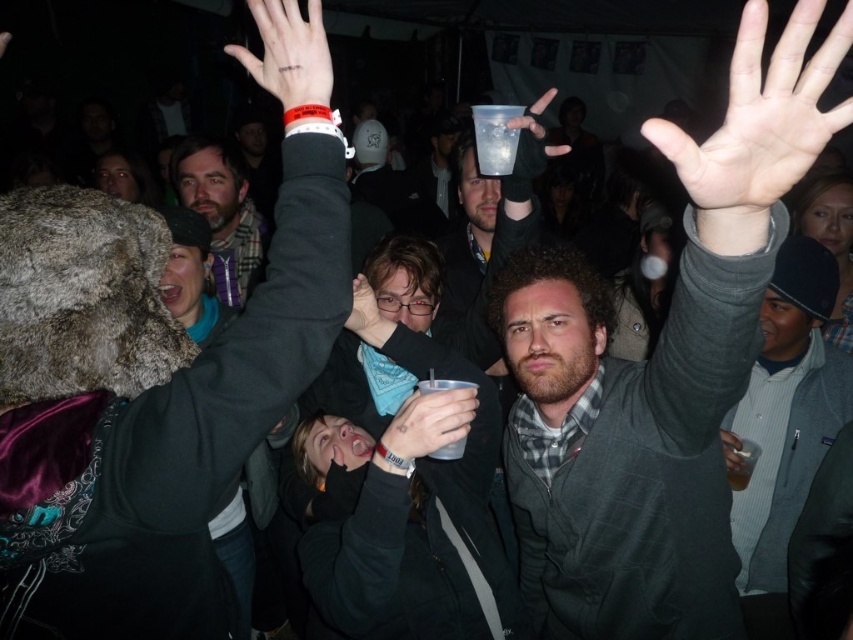
Question: From the image, what is the correct spatial relationship of matte gray sweater at upper right in relation to pale skin palm at upper center?

Choices:
 (A) above
 (B) below

Answer: (B)

Question: Which point is farther from the camera taking this photo?

Choices:
 (A) coord(752,449)
 (B) coord(270,58)
 (C) coord(407,428)
 (D) coord(508,452)

Answer: (D)

Question: Is matte gray sweater at upper right wider than metallic silver cup at center?

Choices:
 (A) yes
 (B) no

Answer: (A)

Question: Which point appears closest to the camera in this image?

Choices:
 (A) (260, 38)
 (B) (703, 179)
 (C) (497, 116)
 (D) (393, 435)

Answer: (B)

Question: Which point is farther to the camera?

Choices:
 (A) [730, 440]
 (B) [741, 147]
 (C) [786, 403]

Answer: (C)

Question: Does matte black wristband at upper center have a smaller size compared to metallic silver cup at center?

Choices:
 (A) yes
 (B) no

Answer: (B)